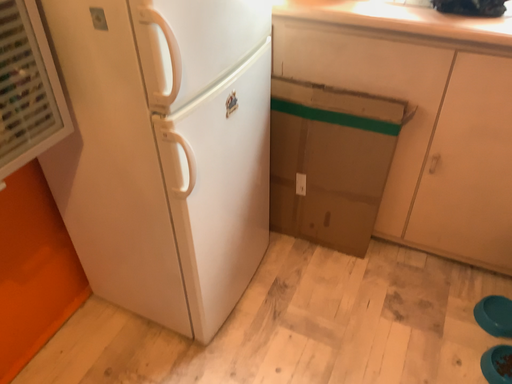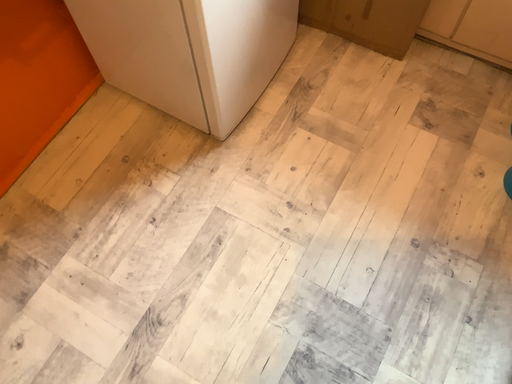
Question: How did the camera likely rotate when shooting the video?

Choices:
 (A) rotated upward
 (B) rotated downward

Answer: (B)